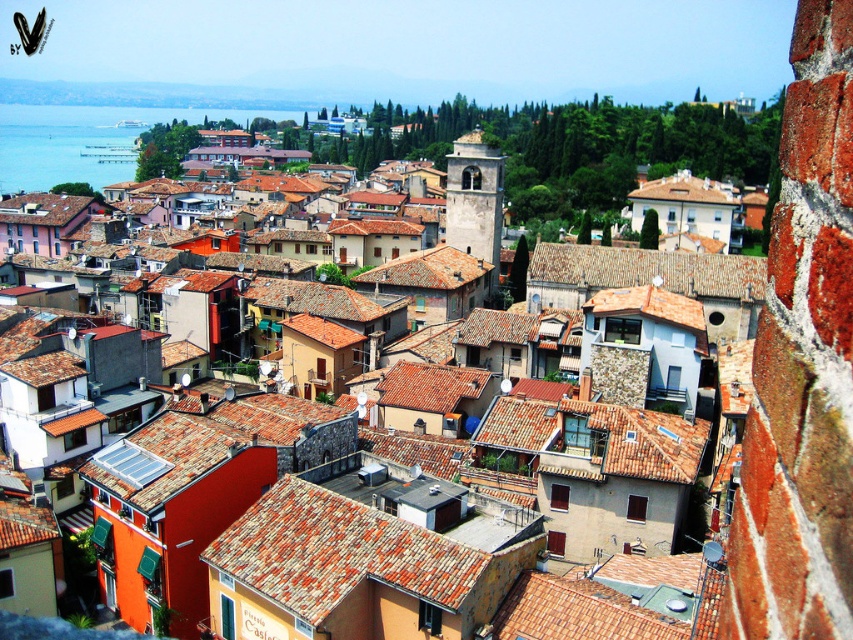
Question: Can you confirm if brown clay roof tiles at center is wider than blue water at left?

Choices:
 (A) yes
 (B) no

Answer: (B)

Question: Is brown clay roof tiles at center wider than blue water at left?

Choices:
 (A) yes
 (B) no

Answer: (B)

Question: Can you confirm if brown clay roof tiles at center is positioned to the left of blue water at left?

Choices:
 (A) yes
 (B) no

Answer: (B)

Question: Which of the following is the farthest from the observer?

Choices:
 (A) (54, 152)
 (B) (592, 472)

Answer: (A)

Question: Among these points, which one is farthest from the camera?

Choices:
 (A) (517, 440)
 (B) (18, 134)

Answer: (B)